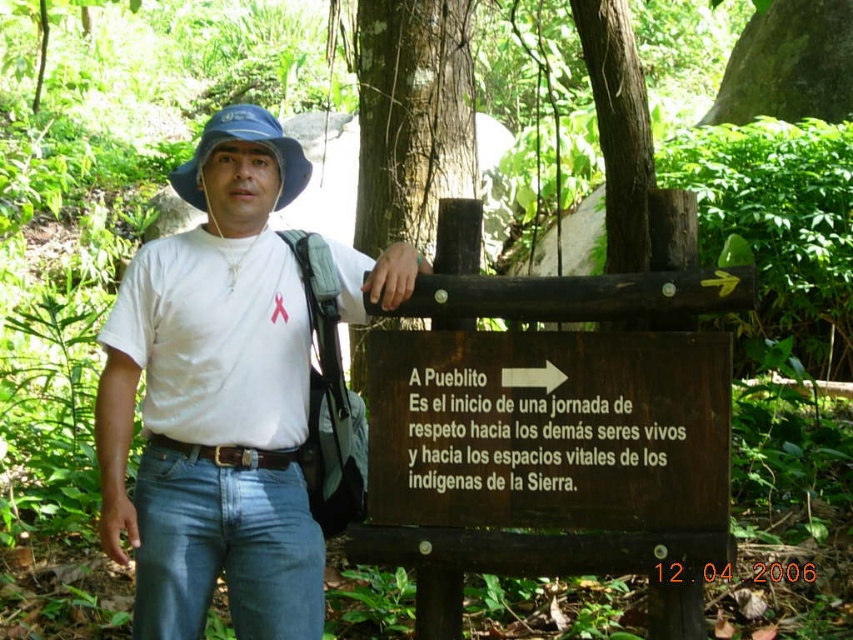
In the scene shown: You are a hiker who wants to take a photo of the brown wooden sign at center and the blue fabric hat at upper center. Which object should you focus on first if you want to capture both in one frame without moving the camera?

You should focus on the brown wooden sign at center first because it is larger than the blue fabric hat at upper center, making it easier to frame both objects in the same shot.

You are a hiker who wants to take a photo of the brown wooden sign at center without the white cotton shirt at center appearing in the frame. How should you adjust your position?

Move the camera downward so the white cotton shirt at center is no longer blocking the view of the brown wooden sign at center.

You are a hiker who wants to take a photo of the brown wooden sign at center and the smooth brown tree trunk at upper center. Which object should you focus on first if you want to capture both in the frame without moving the camera?

You should focus on the brown wooden sign at center first because it is smaller in size compared to the smooth brown tree trunk at upper center, allowing you to frame both objects effectively without moving the camera.